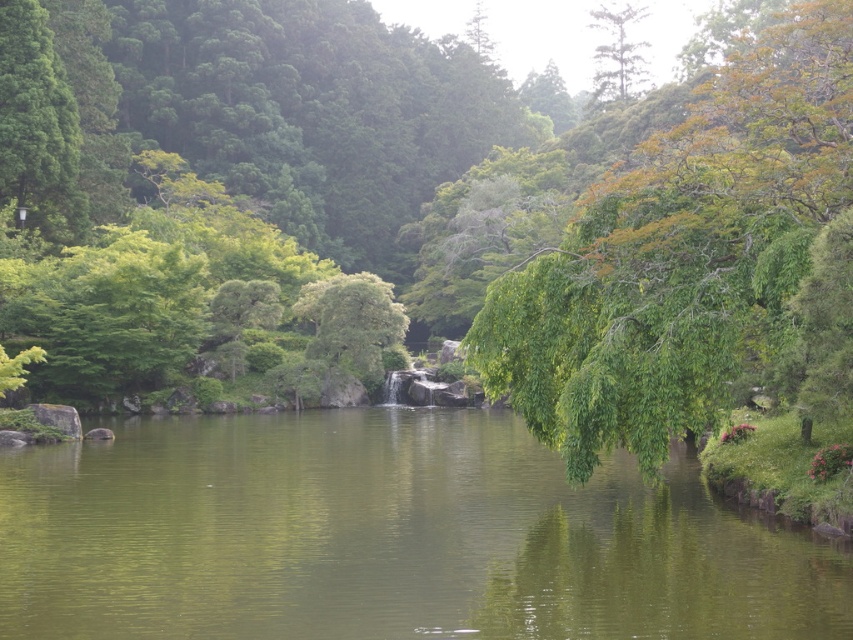
Question: Is green smooth water at center below green leafy tree at upper center?

Choices:
 (A) yes
 (B) no

Answer: (A)

Question: Based on their relative distances, which object is farther from the green leafy tree at right?

Choices:
 (A) green smooth water at center
 (B) green leafy tree at upper center

Answer: (B)

Question: Which point is farther from the camera taking this photo?

Choices:
 (A) (634, 74)
 (B) (830, 44)

Answer: (A)

Question: Which of the following is the closest to the observer?

Choices:
 (A) green leafy tree at upper center
 (B) green smooth water at center
 (C) green leafy tree at right

Answer: (B)

Question: Does green leafy tree at right appear on the left side of green leafy tree at upper center?

Choices:
 (A) no
 (B) yes

Answer: (B)

Question: Is green leafy tree at right to the left of green leafy tree at upper center from the viewer's perspective?

Choices:
 (A) yes
 (B) no

Answer: (A)